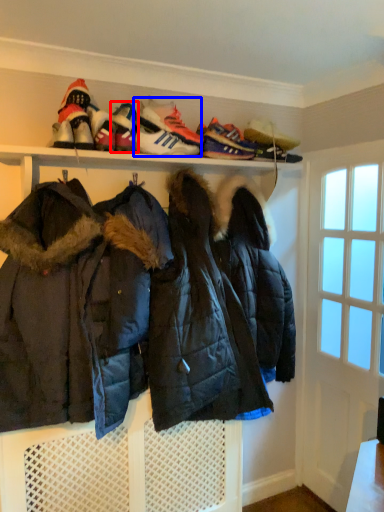
Question: Which object is further to the camera taking this photo, footwear (highlighted by a red box) or footwear (highlighted by a blue box)?

Choices:
 (A) footwear
 (B) footwear

Answer: (B)